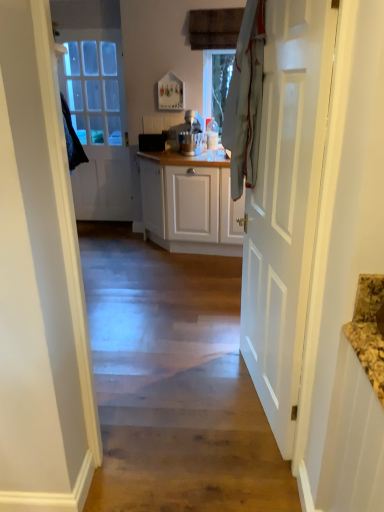
Question: Can you confirm if white glossy door at right, which is the 1th door in right-to-left order, is shorter than white glossy door at left, the first door positioned from the back?

Choices:
 (A) no
 (B) yes

Answer: (B)

Question: Considering the relative sizes of white glossy door at right, which appears as the 1th door when viewed from the front, and white glossy door at left, the 2th door from the right, in the image provided, is white glossy door at right, which appears as the 1th door when viewed from the front, wider than white glossy door at left, the 2th door from the right,?

Choices:
 (A) no
 (B) yes

Answer: (B)

Question: Is the position of white glossy door at right, the 2th door in the back-to-front sequence, more distant than that of white glossy door at left, which is the 2th door from front to back?

Choices:
 (A) no
 (B) yes

Answer: (A)

Question: Can you confirm if white glossy door at right, which is the 1th door in right-to-left order, is positioned to the left of white glossy door at left, the 2th door from the right?

Choices:
 (A) no
 (B) yes

Answer: (A)

Question: Is white glossy door at right, which is the 1th door in right-to-left order, outside white glossy door at left, the 2th door from the right?

Choices:
 (A) no
 (B) yes

Answer: (B)

Question: Is white glossy door at right, which appears as the 1th door when viewed from the front, taller or shorter than white matte stand mixer at center?

Choices:
 (A) tall
 (B) short

Answer: (A)

Question: Do you think white glossy door at right, which is counted as the second door, starting from the left, is within white matte stand mixer at center, or outside of it?

Choices:
 (A) inside
 (B) outside

Answer: (B)

Question: From a real-world perspective, is white glossy door at right, which appears as the 1th door when viewed from the front, physically located above or below white matte stand mixer at center?

Choices:
 (A) above
 (B) below

Answer: (B)

Question: Considering their positions, is white glossy door at right, which appears as the 1th door when viewed from the front, located in front of or behind white matte stand mixer at center?

Choices:
 (A) behind
 (B) front

Answer: (B)

Question: Is white glossy door at right, which is counted as the second door, starting from the left, in front of or behind white glossy door at left, the first door in the left-to-right sequence, in the image?

Choices:
 (A) front
 (B) behind

Answer: (A)

Question: Visually, is white glossy door at right, which is the 1th door in right-to-left order, positioned to the left or to the right of white glossy door at left, the 2th door from the right?

Choices:
 (A) right
 (B) left

Answer: (A)

Question: Is white glossy door at right, the 2th door in the back-to-front sequence, situated inside white glossy door at left, the 2th door from the right, or outside?

Choices:
 (A) inside
 (B) outside

Answer: (B)

Question: From the image's perspective, is white glossy door at right, which is the 1th door in right-to-left order, positioned above or below white glossy door at left, the 2th door from the right?

Choices:
 (A) above
 (B) below

Answer: (B)

Question: From a real-world perspective, is wooden floor at center above or below white matte stand mixer at center?

Choices:
 (A) above
 (B) below

Answer: (B)

Question: In terms of width, does wooden floor at center look wider or thinner when compared to white matte stand mixer at center?

Choices:
 (A) wide
 (B) thin

Answer: (A)